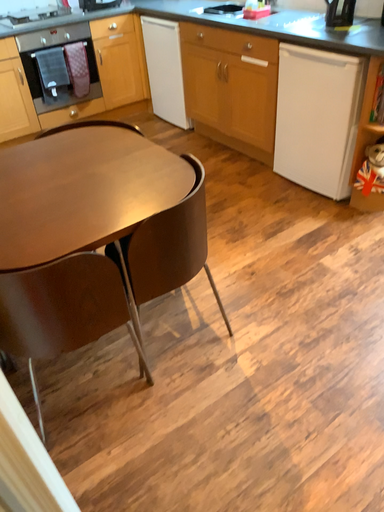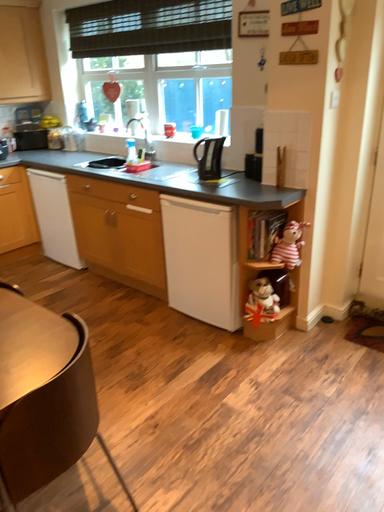
Question: How did the camera likely rotate when shooting the video?

Choices:
 (A) rotated right
 (B) rotated left

Answer: (A)